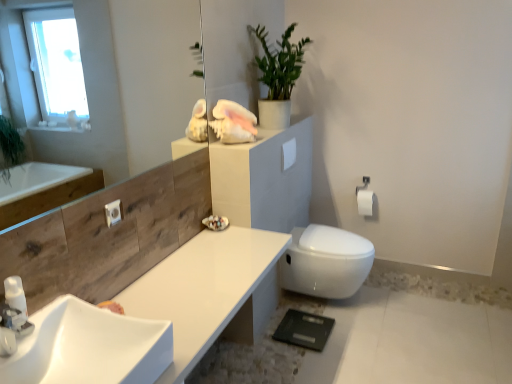
Question: From a real-world perspective, is transparent glass mirror at upper left located higher than white glossy soap dispenser at lower left?

Choices:
 (A) no
 (B) yes

Answer: (B)

Question: Is transparent glass mirror at upper left not close to white glossy soap dispenser at lower left?

Choices:
 (A) yes
 (B) no

Answer: (A)

Question: Does transparent glass mirror at upper left have a smaller size compared to white glossy soap dispenser at lower left?

Choices:
 (A) yes
 (B) no

Answer: (B)

Question: From the image's perspective, is transparent glass mirror at upper left on top of white glossy soap dispenser at lower left?

Choices:
 (A) no
 (B) yes

Answer: (B)

Question: Is the position of transparent glass mirror at upper left more distant than that of white glossy soap dispenser at lower left?

Choices:
 (A) no
 (B) yes

Answer: (A)

Question: From the image's perspective, is white glossy sink at lower left located above or below white glossy tap at lower left?

Choices:
 (A) below
 (B) above

Answer: (A)

Question: Is point (87, 372) positioned closer to the camera than point (18, 334)?

Choices:
 (A) farther
 (B) closer

Answer: (A)

Question: In the image, is white glossy sink at lower left positioned in front of or behind white glossy tap at lower left?

Choices:
 (A) front
 (B) behind

Answer: (A)

Question: In terms of width, does white glossy sink at lower left look wider or thinner when compared to white glossy tap at lower left?

Choices:
 (A) wide
 (B) thin

Answer: (A)

Question: Is white glossy sink at lower left wider or thinner than white glossy soap dispenser at lower left?

Choices:
 (A) wide
 (B) thin

Answer: (A)

Question: Based on their sizes in the image, would you say white glossy sink at lower left is bigger or smaller than white glossy soap dispenser at lower left?

Choices:
 (A) small
 (B) big

Answer: (B)

Question: From their relative heights in the image, would you say white glossy sink at lower left is taller or shorter than white glossy soap dispenser at lower left?

Choices:
 (A) short
 (B) tall

Answer: (A)

Question: Visually, is white glossy sink at lower left positioned to the left or to the right of white glossy soap dispenser at lower left?

Choices:
 (A) right
 (B) left

Answer: (A)

Question: Considering the relative positions of green matte plant at upper center and white matte toilet paper at right, the first toilet paper ordered from the bottom, in the image provided, is green matte plant at upper center to the left or to the right of white matte toilet paper at right, the first toilet paper ordered from the bottom,?

Choices:
 (A) left
 (B) right

Answer: (A)

Question: Looking at their shapes, would you say green matte plant at upper center is wider or thinner than white matte toilet paper at right, the first toilet paper ordered from the bottom?

Choices:
 (A) wide
 (B) thin

Answer: (A)